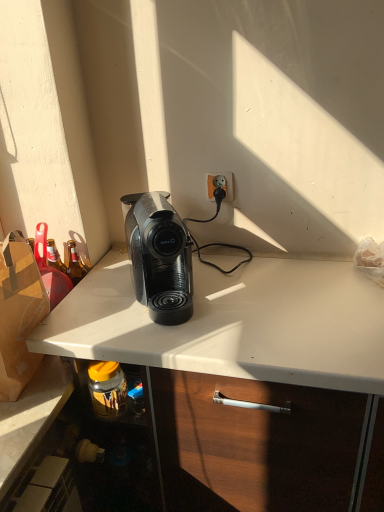
Question: Does orange matte power outlet at upper center appear on the right side of black plastic coffee machine at center?

Choices:
 (A) no
 (B) yes

Answer: (B)

Question: Does orange matte power outlet at upper center have a greater height compared to black plastic coffee machine at center?

Choices:
 (A) yes
 (B) no

Answer: (B)

Question: Considering the relative sizes of orange matte power outlet at upper center and black plastic coffee machine at center in the image provided, is orange matte power outlet at upper center bigger than black plastic coffee machine at center?

Choices:
 (A) no
 (B) yes

Answer: (A)

Question: Are orange matte power outlet at upper center and black plastic coffee machine at center far apart?

Choices:
 (A) yes
 (B) no

Answer: (B)

Question: Can you confirm if orange matte power outlet at upper center is smaller than black plastic coffee machine at center?

Choices:
 (A) yes
 (B) no

Answer: (A)

Question: Is orange matte power outlet at upper center facing towards black plastic coffee machine at center?

Choices:
 (A) no
 (B) yes

Answer: (B)

Question: Considering the relative sizes of black plastic coffee machine at center and orange matte power outlet at upper center in the image provided, is black plastic coffee machine at center shorter than orange matte power outlet at upper center?

Choices:
 (A) no
 (B) yes

Answer: (A)

Question: Can you confirm if black plastic coffee machine at center is taller than orange matte power outlet at upper center?

Choices:
 (A) yes
 (B) no

Answer: (A)

Question: Are black plastic coffee machine at center and orange matte power outlet at upper center located far from each other?

Choices:
 (A) no
 (B) yes

Answer: (A)

Question: From the image's perspective, is black plastic coffee machine at center located beneath orange matte power outlet at upper center?

Choices:
 (A) yes
 (B) no

Answer: (A)

Question: From a real-world perspective, is black plastic coffee machine at center physically above orange matte power outlet at upper center?

Choices:
 (A) yes
 (B) no

Answer: (B)

Question: Does black plastic coffee machine at center have a larger size compared to orange matte power outlet at upper center?

Choices:
 (A) yes
 (B) no

Answer: (A)

Question: Based on their positions, is orange matte power outlet at upper center located to the left or right of black plastic coffee machine at center?

Choices:
 (A) left
 (B) right

Answer: (B)